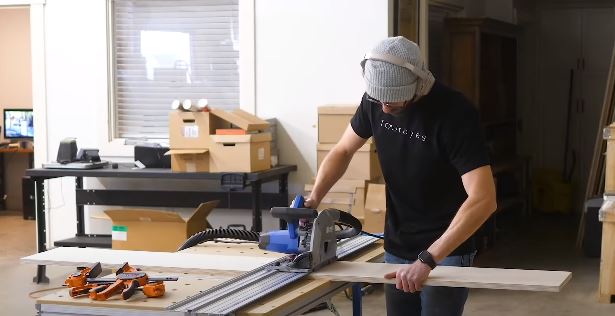
At what (x,y) coordinates should I click in order to perform the action: click on head phones. Please return your answer as a coordinate pair (x, y). Looking at the image, I should click on (426, 83).